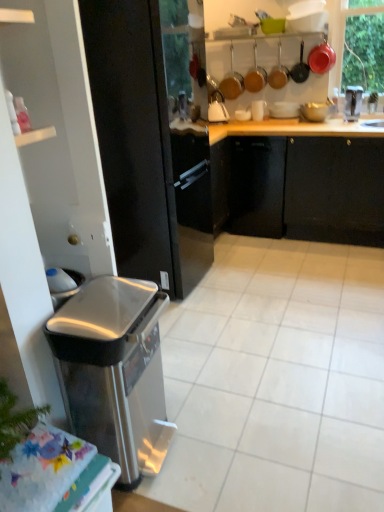
Question: Is matte red pot at upper right, marked as the second appliance in a right-to-left arrangement, oriented towards white glossy sink at upper right?

Choices:
 (A) yes
 (B) no

Answer: (B)

Question: Is matte red pot at upper right, marked as the second appliance in a right-to-left arrangement, oriented away from white glossy sink at upper right?

Choices:
 (A) yes
 (B) no

Answer: (B)

Question: Considering the relative sizes of matte red pot at upper right, marked as the second appliance in a right-to-left arrangement, and white glossy sink at upper right in the image provided, is matte red pot at upper right, marked as the second appliance in a right-to-left arrangement, smaller than white glossy sink at upper right?

Choices:
 (A) no
 (B) yes

Answer: (B)

Question: Is matte red pot at upper right, the sixth appliance positioned from the left, further to the viewer compared to white glossy sink at upper right?

Choices:
 (A) no
 (B) yes

Answer: (B)

Question: Considering the relative sizes of matte red pot at upper right, the sixth appliance positioned from the left, and white glossy sink at upper right in the image provided, is matte red pot at upper right, the sixth appliance positioned from the left, bigger than white glossy sink at upper right?

Choices:
 (A) yes
 (B) no

Answer: (B)

Question: Does matte red pot at upper right, the sixth appliance positioned from the left, appear on the right side of white glossy sink at upper right?

Choices:
 (A) no
 (B) yes

Answer: (A)

Question: Considering the relative sizes of metallic stainless steel faucet at upper right, which ranks as the 7th appliance in left-to-right order, and white glossy sink at upper right in the image provided, is metallic stainless steel faucet at upper right, which ranks as the 7th appliance in left-to-right order, shorter than white glossy sink at upper right?

Choices:
 (A) yes
 (B) no

Answer: (A)

Question: Does metallic stainless steel faucet at upper right, which ranks as the 7th appliance in left-to-right order, have a greater width compared to white glossy sink at upper right?

Choices:
 (A) yes
 (B) no

Answer: (B)

Question: Is metallic stainless steel faucet at upper right, marked as the 1th appliance in a right-to-left arrangement, to the right of white glossy sink at upper right from the viewer's perspective?

Choices:
 (A) yes
 (B) no

Answer: (B)

Question: Can you confirm if metallic stainless steel faucet at upper right, marked as the 1th appliance in a right-to-left arrangement, is taller than white glossy sink at upper right?

Choices:
 (A) yes
 (B) no

Answer: (B)

Question: Is metallic stainless steel faucet at upper right, marked as the 1th appliance in a right-to-left arrangement, far away from white glossy sink at upper right?

Choices:
 (A) yes
 (B) no

Answer: (B)

Question: Is metallic stainless steel faucet at upper right, marked as the 1th appliance in a right-to-left arrangement, not inside white glossy sink at upper right?

Choices:
 (A) yes
 (B) no

Answer: (A)

Question: Does matte red pot at upper right, marked as the second appliance in a right-to-left arrangement, lie behind white glossy bowl at upper center, the 3th appliance positioned from the left?

Choices:
 (A) yes
 (B) no

Answer: (B)